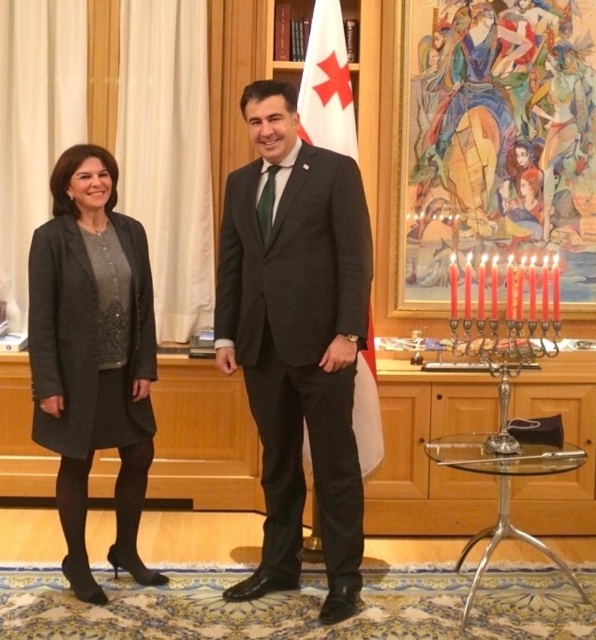
What are the coordinates of the dark gray wool coat at center?

The dark gray wool coat at center is located at coordinates point (299, 330).